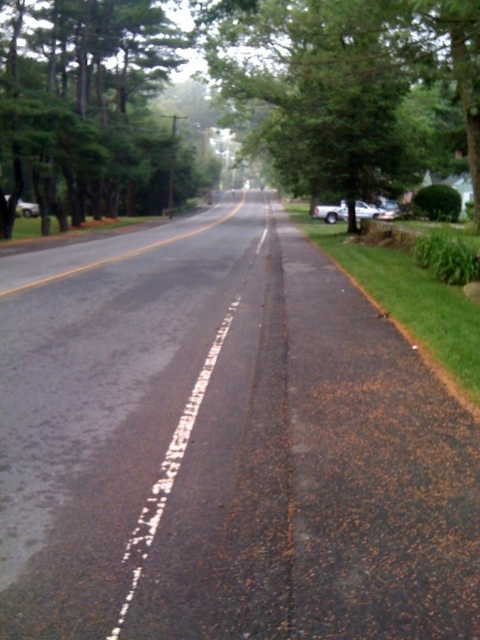
You are driving a car and need to stay within your lane on the two lane road. The green leafy tree at center and white dashed line at center are both visible ahead. Which one should you use as a reference to keep your car properly aligned?

You should use the white dashed line at center as a reference because the green leafy tree at center is wider than the white dashed line at center, making the line a more reliable and precise guide for lane alignment.

You are driving a car and need to stay within the lanes on the two lane road. The green leafy tree at left and the white dashed line at center are both visible in your view. Which one of these two objects is wider from your perspective?

The green leafy tree at left is wider than the white dashed line at center from your perspective.

You are standing at the starting point of the road. Looking ahead, where is the green leafy tree at center located in relation to your position?

The green leafy tree at center is located at point 0.134 on the x axis and 0.735 on the y axis relative to your position.